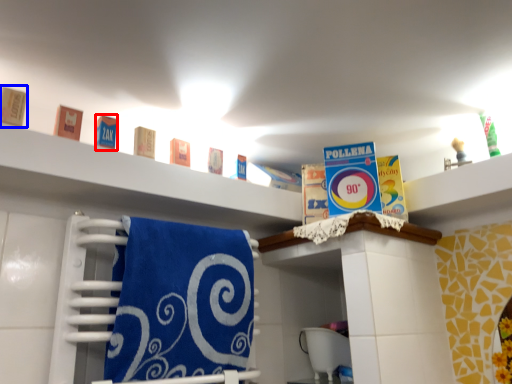
Question: Which of the following is the closest to the observer, product (highlighted by a red box) or product (highlighted by a blue box)?

Choices:
 (A) product
 (B) product

Answer: (B)